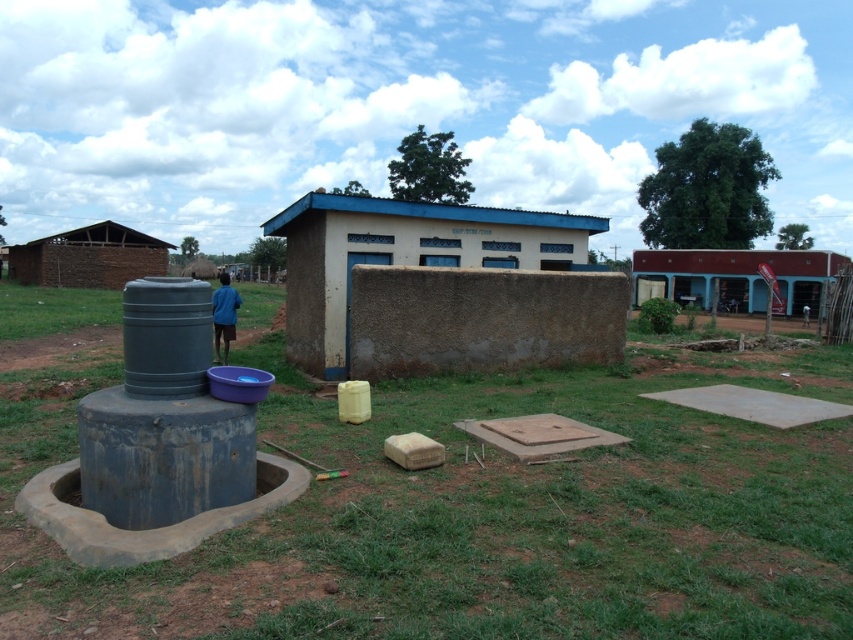
Question: Is brick wall building at right positioned in front of blue fabric shirt at center?

Choices:
 (A) no
 (B) yes

Answer: (A)

Question: Estimate the real-world distances between objects in this image. Which object is farther from the brick wall building at right?

Choices:
 (A) blue fabric shirt at center
 (B) brown mud hut at center
 (C) green grass at lower center
 (D) brown mud hut at upper left

Answer: (D)

Question: Can you confirm if brown mud hut at center is positioned to the right of brick wall building at right?

Choices:
 (A) yes
 (B) no

Answer: (B)

Question: Which point is farther from the camera taking this photo?

Choices:
 (A) (227, 355)
 (B) (727, 294)

Answer: (B)

Question: Can you confirm if green grass at lower center is positioned to the left of brick wall building at right?

Choices:
 (A) no
 (B) yes

Answer: (B)

Question: Which of the following is the closest to the observer?

Choices:
 (A) (704, 460)
 (B) (45, 285)

Answer: (A)